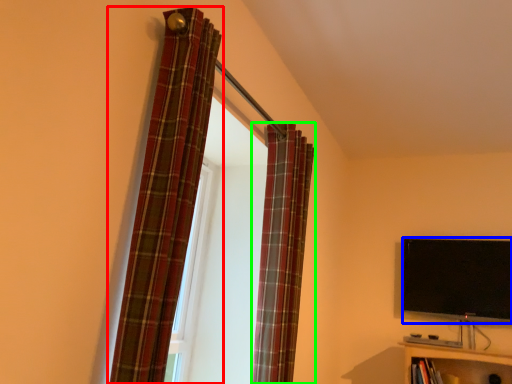
Question: Estimate the real-world distances between objects in this image. Which object is closer to curtain (highlighted by a red box), television (highlighted by a blue box) or curtain (highlighted by a green box)?

Choices:
 (A) television
 (B) curtain

Answer: (B)